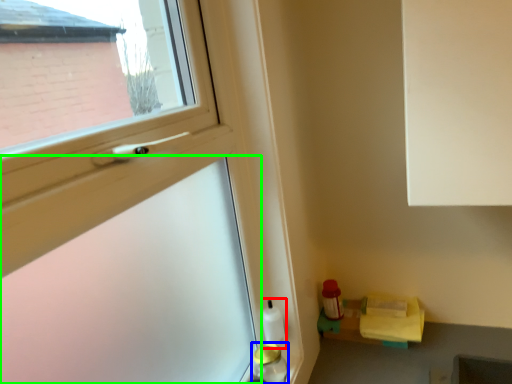
Question: Considering the real-world distances, which object is closest to bottle (highlighted by a red box)? bottle (highlighted by a blue box) or screen door (highlighted by a green box).

Choices:
 (A) bottle
 (B) screen door

Answer: (A)